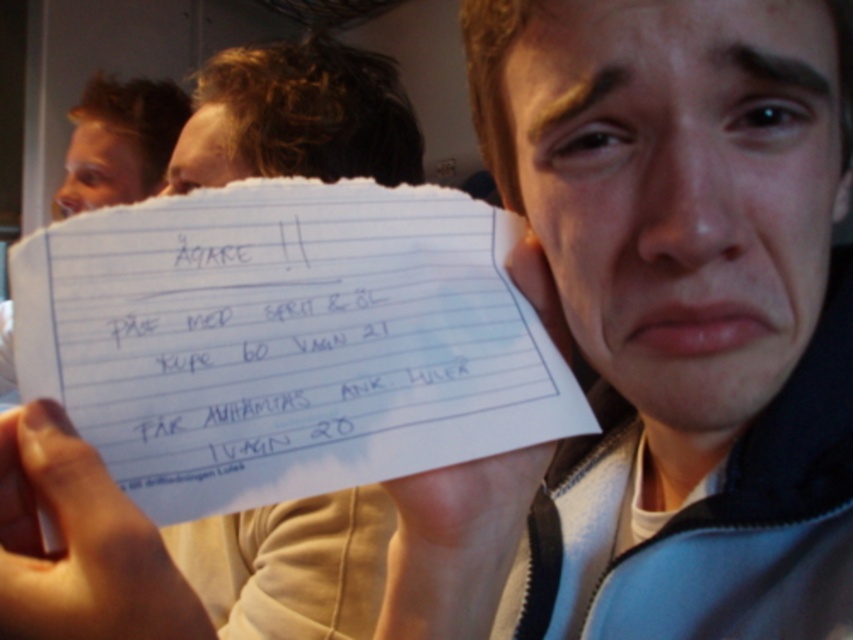
Question: Can you confirm if white paper at center is positioned to the right of matte white nose at center?

Choices:
 (A) no
 (B) yes

Answer: (A)

Question: Estimate the real-world distances between objects in this image. Which object is farther from the white lined paper at center?

Choices:
 (A) white paper at center
 (B) matte white nose at center
 (C) white paper at left

Answer: (C)

Question: Which of these objects is positioned farthest from the matte white nose at center?

Choices:
 (A) white lined paper at center
 (B) white paper at left
 (C) white paper at center

Answer: (B)

Question: Which point is farther to the camera?

Choices:
 (A) [x=717, y=20]
 (B) [x=3, y=387]

Answer: (B)

Question: Does white paper at center appear on the left side of white paper at left?

Choices:
 (A) no
 (B) yes

Answer: (A)

Question: Is matte white nose at center thinner than white paper at left?

Choices:
 (A) no
 (B) yes

Answer: (B)